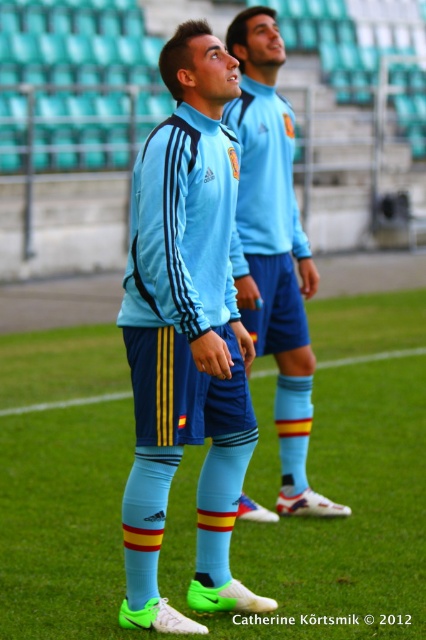
The width and height of the screenshot is (426, 640). What do you see at coordinates (186, 337) in the screenshot?
I see `light blue matte jersey at center` at bounding box center [186, 337].

Is point (189, 141) positioned behind point (54, 406)?

No, it is not.

The width and height of the screenshot is (426, 640). What are the coordinates of `light blue matte jersey at center` in the screenshot? It's located at point(186,337).

The image size is (426, 640). What do you see at coordinates (183, 282) in the screenshot?
I see `matte blue tracksuit at center` at bounding box center [183, 282].

Is point (143, 426) behind point (256, 376)?

No, it is not.

Between point (233, 152) and point (63, 406), which one is positioned behind?

The point (63, 406) is more distant.

At what (x,y) coordinates should I click in order to perform the action: click on matte blue tracksuit at center. Please return your answer as a coordinate pair (x, y). This screenshot has height=640, width=426. Looking at the image, I should click on (183, 282).

Can you confirm if blue matte soccer uniform at center is shorter than blue fabric shorts at center?

In fact, blue matte soccer uniform at center may be taller than blue fabric shorts at center.

The height and width of the screenshot is (640, 426). What do you see at coordinates (273, 248) in the screenshot?
I see `blue matte soccer uniform at center` at bounding box center [273, 248].

Is point (241, 140) behind point (258, 378)?

No, it is not.

Find the location of a particular element. The image size is (426, 640). blue matte soccer uniform at center is located at coordinates (273, 248).